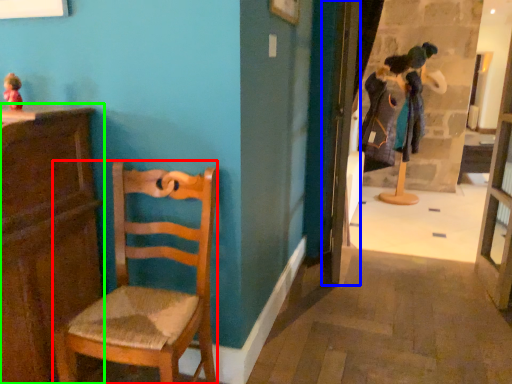
Question: Which object is the closest to the chair (highlighted by a red box)? Choose among these: door (highlighted by a blue box) or cabinetry (highlighted by a green box).

Choices:
 (A) door
 (B) cabinetry

Answer: (B)